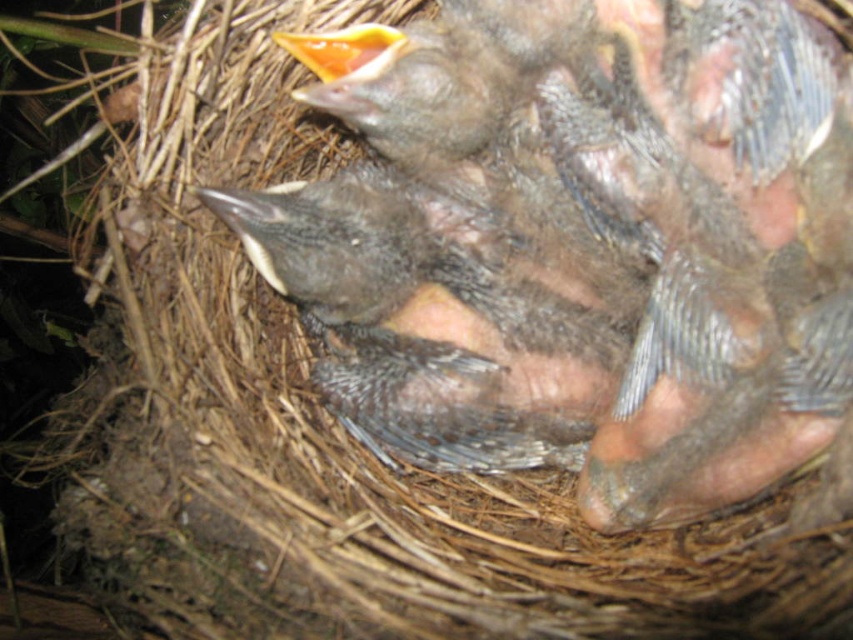
Question: Can you confirm if dark gray downy feathers at center is wider than yellow-orange beak at upper center?

Choices:
 (A) no
 (B) yes

Answer: (B)

Question: Which point appears farthest from the camera in this image?

Choices:
 (A) (326, 321)
 (B) (364, 58)

Answer: (A)

Question: Is dark gray downy feathers at center to the right of yellow-orange beak at upper center from the viewer's perspective?

Choices:
 (A) no
 (B) yes

Answer: (B)

Question: Can you confirm if dark gray downy feathers at center is positioned to the right of yellow-orange beak at upper center?

Choices:
 (A) no
 (B) yes

Answer: (B)